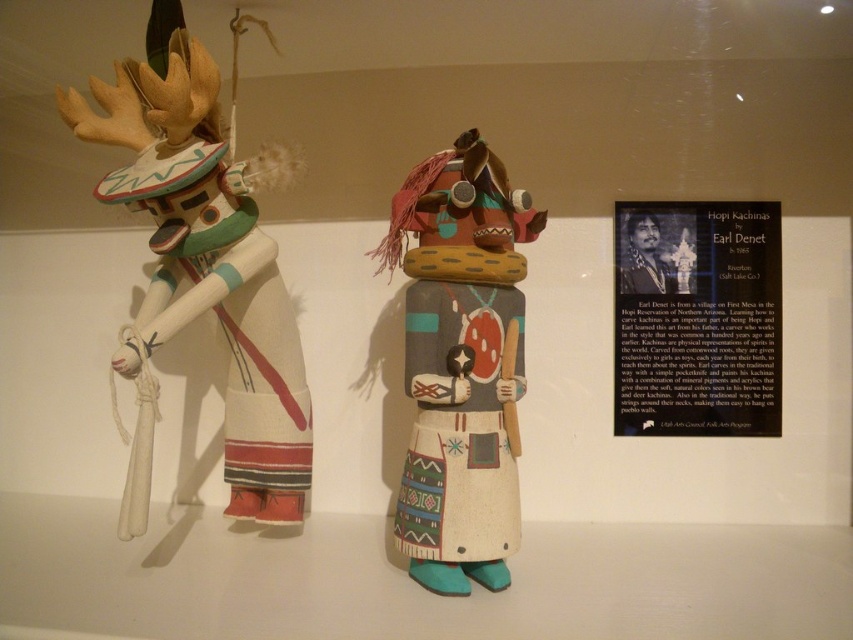
Question: Is matte white kachina at left behind matte painted kachina at center?

Choices:
 (A) yes
 (B) no

Answer: (B)

Question: Among these objects, which one is farthest from the camera?

Choices:
 (A) matte white kachina at left
 (B) matte painted kachina at center

Answer: (B)

Question: Can you confirm if matte white kachina at left is thinner than matte painted kachina at center?

Choices:
 (A) yes
 (B) no

Answer: (B)

Question: Among these objects, which one is nearest to the camera?

Choices:
 (A) matte painted kachina at center
 (B) matte white kachina at left

Answer: (B)

Question: Does matte white kachina at left appear on the right side of matte painted kachina at center?

Choices:
 (A) yes
 (B) no

Answer: (B)